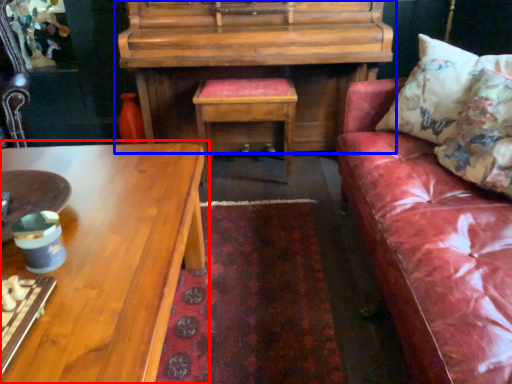
Question: Among these objects, which one is nearest to the camera, coffee table (highlighted by a red box) or piano (highlighted by a blue box)?

Choices:
 (A) coffee table
 (B) piano

Answer: (A)